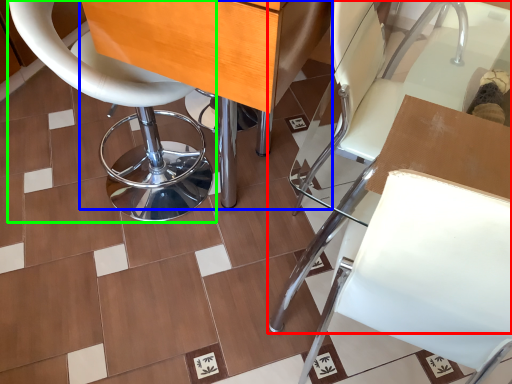
Question: Estimate the real-world distances between objects in this image. Which object is farther from chair (highlighted by a red box), table (highlighted by a blue box) or chair (highlighted by a green box)?

Choices:
 (A) table
 (B) chair

Answer: (B)